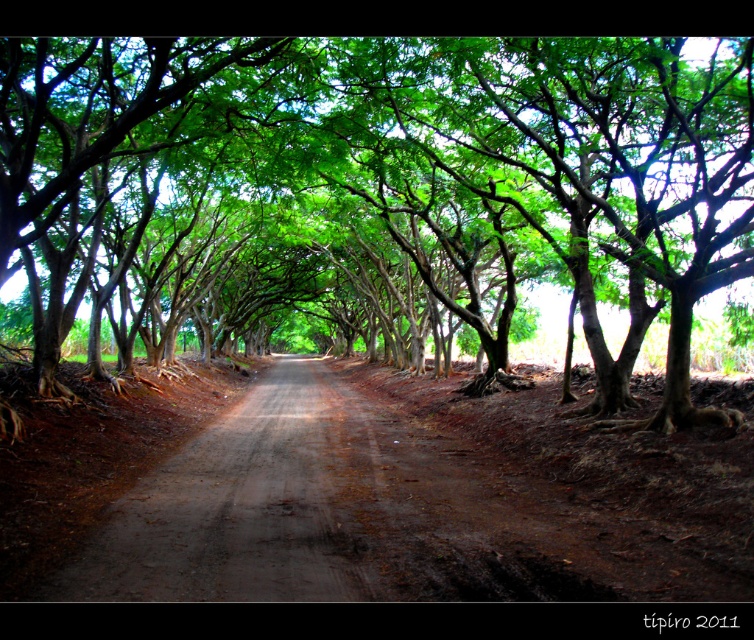
Question: Observing the image, what is the correct spatial positioning of green leafy tree at center in reference to dirt road at center?

Choices:
 (A) left
 (B) right

Answer: (A)

Question: Is green leafy tree at center smaller than dirt road at center?

Choices:
 (A) yes
 (B) no

Answer: (B)

Question: Is the position of green leafy tree at center more distant than that of dirt road at center?

Choices:
 (A) yes
 (B) no

Answer: (A)

Question: Which point appears farthest from the camera in this image?

Choices:
 (A) (133, 556)
 (B) (595, 250)

Answer: (B)

Question: Which of the following is the farthest from the observer?

Choices:
 (A) (593, 412)
 (B) (244, 561)

Answer: (A)

Question: Which point is farther to the camera?

Choices:
 (A) dirt road at center
 (B) green leafy tree at center

Answer: (B)